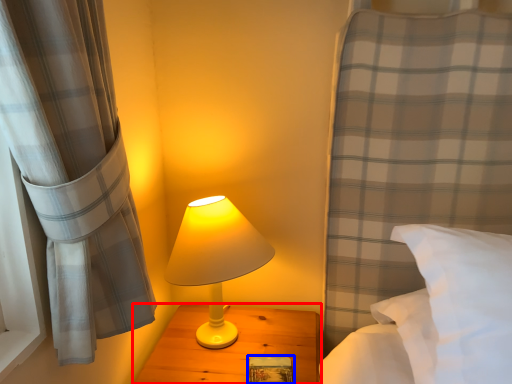
Question: Which object appears closest to the camera in this image, nightstand (highlighted by a red box) or book (highlighted by a blue box)?

Choices:
 (A) nightstand
 (B) book

Answer: (A)